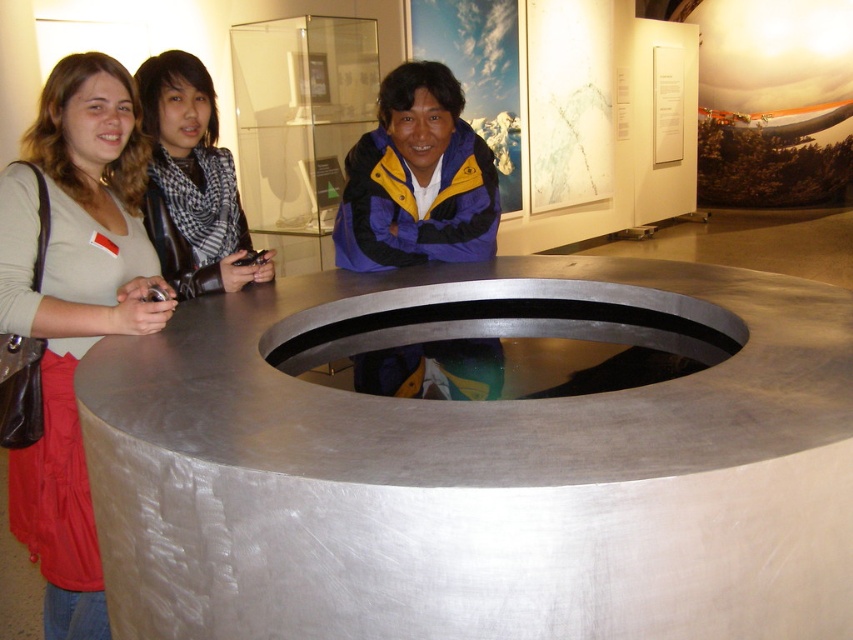
You are a tour guide in the museum and need to direct a visitor to a specific point. The visitor is currently at point (206, 182). Which direction should they move to reach point (486, 202)?

The visitor should move forward towards point (486, 202) because it is closer to them than point (206, 182).